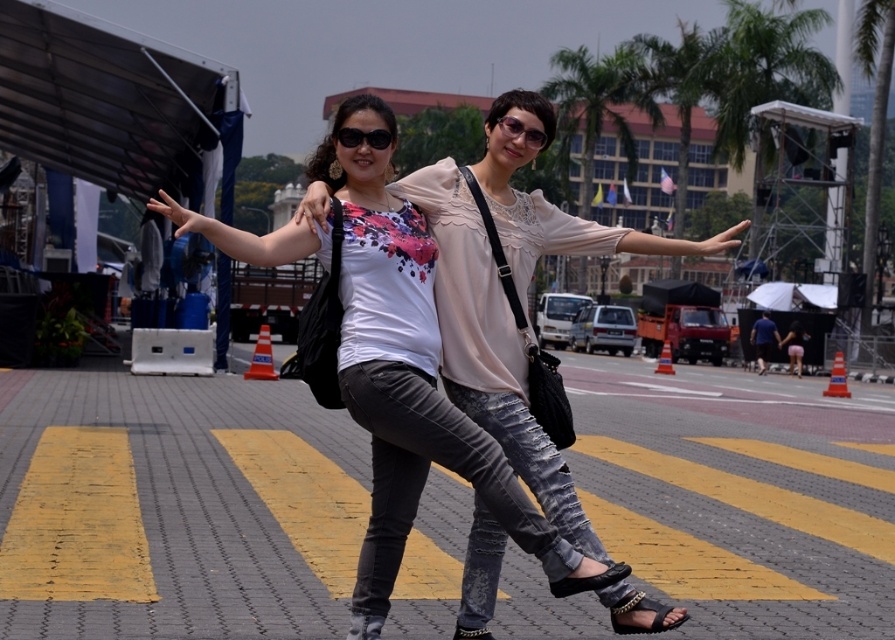
Image resolution: width=895 pixels, height=640 pixels. What do you see at coordinates (175, 506) in the screenshot?
I see `gray brick pavement at center` at bounding box center [175, 506].

Which is in front, point (171, 596) or point (348, 129)?

Point (348, 129)

Where is `gray brick pavement at center`? gray brick pavement at center is located at coordinates (175, 506).

Is gray brick pavement at center shorter than matte black sunglasses at upper center?

No.

Is gray brick pavement at center behind matte black sunglasses at upper center?

Yes, it is.

Which is in front, point (224, 540) or point (517, 131)?

Point (517, 131)

I want to click on gray brick pavement at center, so click(x=175, y=506).

Who is higher up, matte black top at center or matte black sunglasses at upper center?

Positioned higher is matte black sunglasses at upper center.

Does point (557, 548) come in front of point (506, 124)?

Yes.

This screenshot has height=640, width=895. Find the location of `matte black top at center`. matte black top at center is located at coordinates (411, 381).